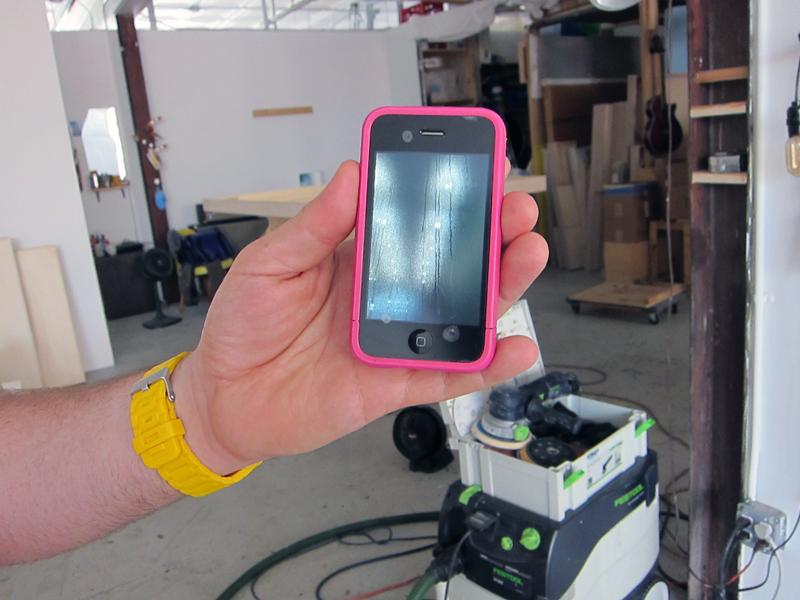
Where is `cardboard boxes`? Image resolution: width=800 pixels, height=600 pixels. cardboard boxes is located at coordinates (568, 218).